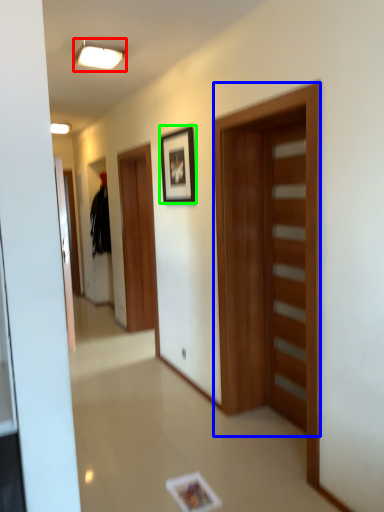
Question: Based on their relative distances, which object is farther from light fixture (highlighted by a red box)? Choose from door (highlighted by a blue box) and picture frame (highlighted by a green box).

Choices:
 (A) door
 (B) picture frame

Answer: (A)